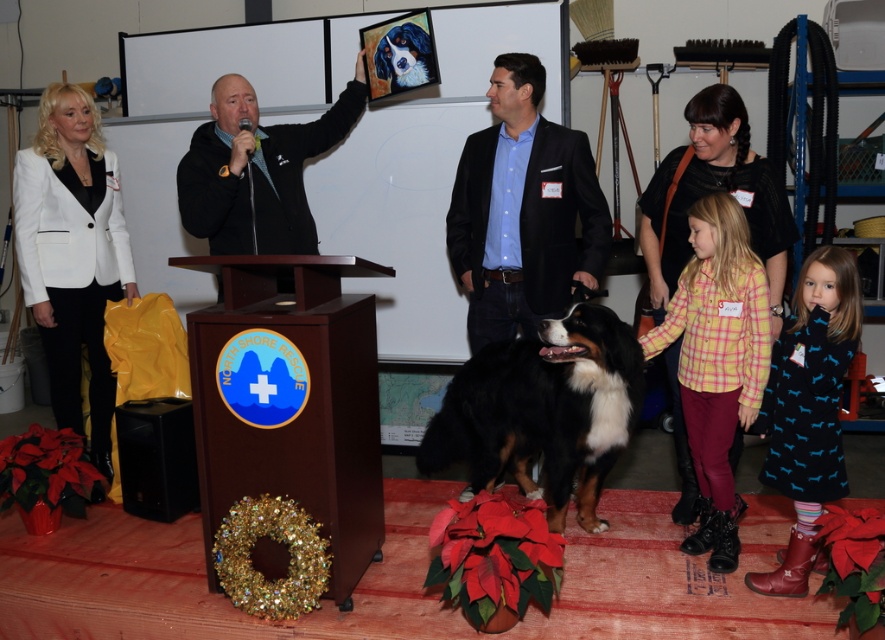
Locate an element on the screen. black wool suit at center is located at coordinates (522, 211).

Between black wool suit at center and smooth black and white dog at center, which one appears on the right side from the viewer's perspective?

Positioned to the right is black wool suit at center.

Who is more distant from viewer, (508, 232) or (425, 51)?

Point (425, 51)

Identify the location of black wool suit at center. This screenshot has width=885, height=640. (522, 211).

Is black and white fur at center wider than white matte blazer at left?

Indeed, black and white fur at center has a greater width compared to white matte blazer at left.

Is point (501, 356) positioned before point (99, 333)?

Yes.

Image resolution: width=885 pixels, height=640 pixels. What are the coordinates of `black and white fur at center` in the screenshot? It's located at (543, 410).

Consider the image. Who is higher up, black wool suit at center or white matte blazer at left?

Positioned higher is black wool suit at center.

How distant is black wool suit at center from white matte blazer at left?

They are 5.12 feet apart.

Does point (545, 136) lie in front of point (70, 211)?

Yes, point (545, 136) is in front of point (70, 211).

Identify the location of black wool suit at center. The image size is (885, 640). (522, 211).